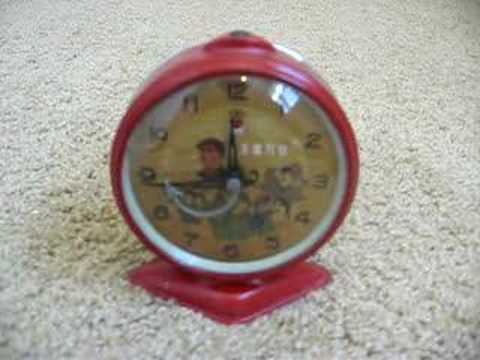
Identify the location of clock. (342, 173).